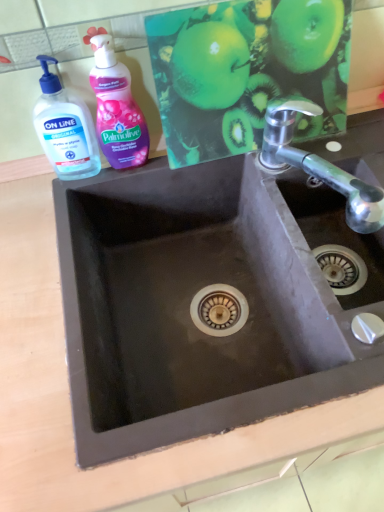
Identify the location of vacant space to the right of pink glossy liquid soap at upper left. This screenshot has height=512, width=384. (193, 156).